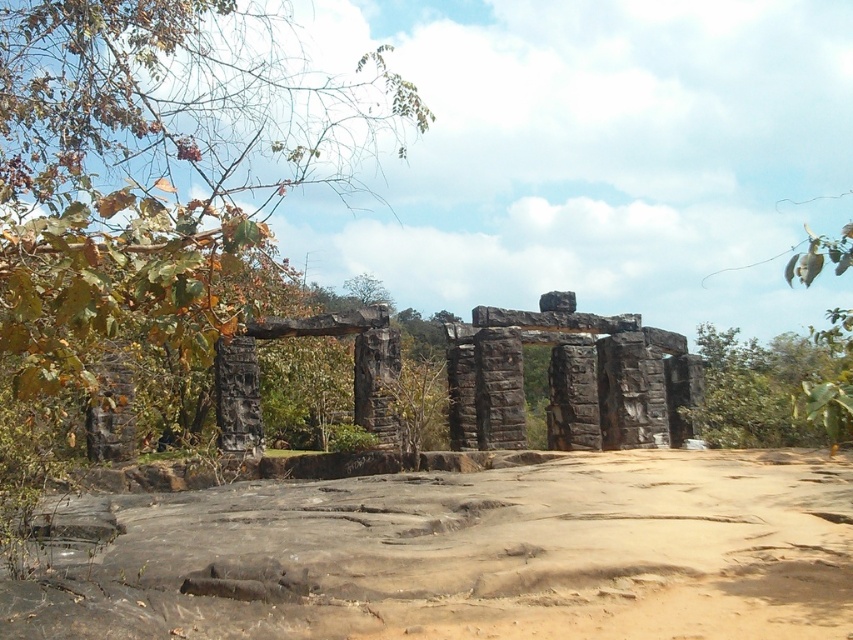
Question: Is brown sandy dirt field at center to the left of green leafy tree at left from the viewer's perspective?

Choices:
 (A) no
 (B) yes

Answer: (A)

Question: Which object is the farthest from the dark stone ruins at center?

Choices:
 (A) green leafy tree at center
 (B) brown sandy dirt field at center
 (C) green leafy tree at left

Answer: (C)

Question: Which point is closer to the camera taking this photo?

Choices:
 (A) (155, 525)
 (B) (592, 380)
 (C) (254, 116)
 (D) (798, 406)

Answer: (A)

Question: Is brown sandy dirt field at center below green leafy tree at left?

Choices:
 (A) yes
 (B) no

Answer: (A)

Question: Which of these objects is positioned closest to the green leafy tree at center?

Choices:
 (A) green leafy tree at left
 (B) dark stone ruins at center
 (C) brown sandy dirt field at center

Answer: (B)

Question: Is green leafy tree at left below dark stone ruins at center?

Choices:
 (A) no
 (B) yes

Answer: (A)